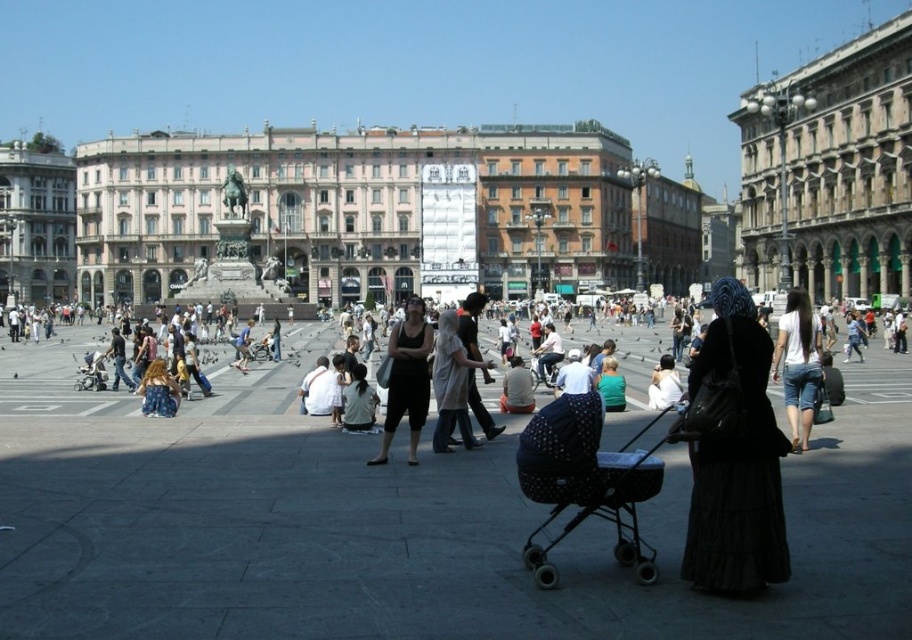
Between beige stone palace at center and matte black tank top at center, which one appears on the left side from the viewer's perspective?

From the viewer's perspective, matte black tank top at center appears more on the left side.

Between beige stone palace at center and matte black tank top at center, which one is positioned lower?

matte black tank top at center is lower down.

Does point (314, 193) lie behind point (413, 436)?

Yes, point (314, 193) is behind point (413, 436).

This screenshot has width=912, height=640. In order to click on beige stone palace at center in this screenshot , I will do `click(363, 209)`.

Can you confirm if beige stone building at right is positioned below denim skirt at lower left?

Actually, beige stone building at right is above denim skirt at lower left.

Who is more forward, [890,56] or [169,378]?

Point [169,378]

Identify the location of beige stone building at right. (833, 172).

Is point (698, 545) positioned before point (809, 337)?

Yes, it is in front of point (809, 337).

Identify the location of black fabric dress at center. The width and height of the screenshot is (912, 640). (733, 454).